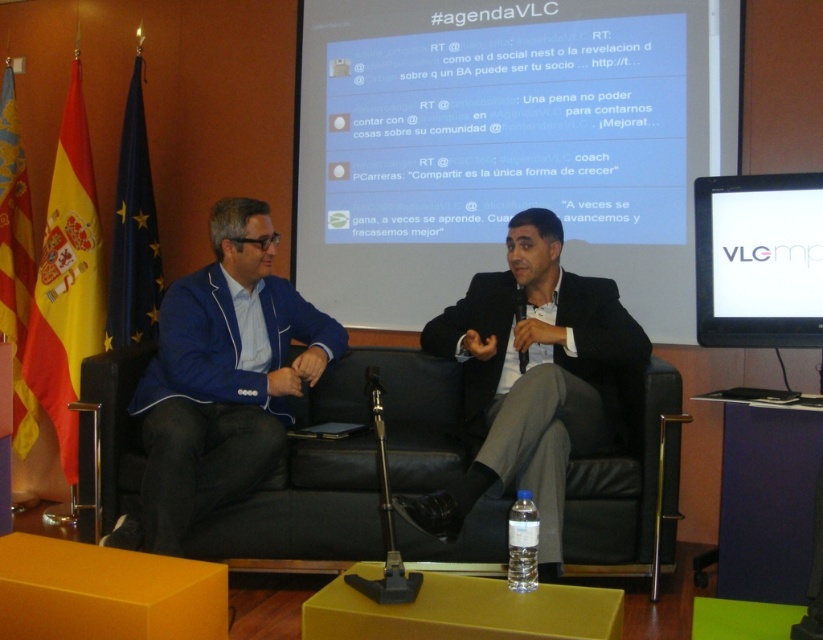
Does point (340, 150) lie in front of point (543, 467)?

No, (340, 150) is behind (543, 467).

Between point (622, 90) and point (533, 448), which one is positioned in front?

Point (533, 448)

At what (x,y) coordinates should I click in order to perform the action: click on white glossy projection screen at upper center. Please return your answer as a coordinate pair (x, y). The image size is (823, 640). Looking at the image, I should click on (505, 145).

Can you confirm if dark gray suit at center is shorter than white glossy monitor at upper right?

No.

Is dark gray suit at center positioned in front of white glossy monitor at upper right?

Yes, dark gray suit at center is closer to the viewer.

Is point (482, 400) positioned behind point (803, 182)?

Yes, it is.

You are a GUI agent. You are given a task and a screenshot of the screen. Output one action in this format:
    pyautogui.click(x=<x>, y=<y>)
    Task: Click on the dark gray suit at center
    The height and width of the screenshot is (640, 823).
    Given the screenshot: What is the action you would take?
    pyautogui.click(x=529, y=380)

Does dark gray suit at center appear on the right side of blue fabric jacket at center?

Correct, you'll find dark gray suit at center to the right of blue fabric jacket at center.

Based on the photo, does dark gray suit at center have a lesser width compared to blue fabric jacket at center?

In fact, dark gray suit at center might be wider than blue fabric jacket at center.

Is point (570, 292) closer to camera compared to point (217, 477)?

No, (570, 292) is behind (217, 477).

Locate an element on the screen. This screenshot has width=823, height=640. dark gray suit at center is located at coordinates (529, 380).